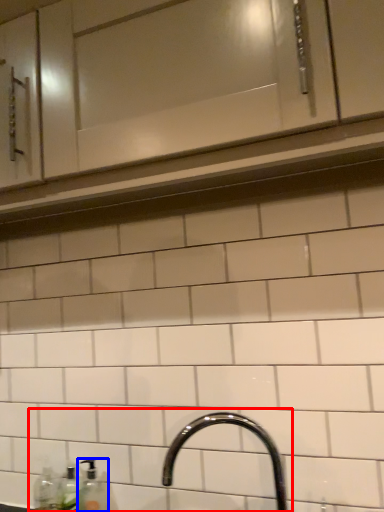
Question: Which object is further to the camera taking this photo, sink (highlighted by a red box) or soap dispenser (highlighted by a blue box)?

Choices:
 (A) sink
 (B) soap dispenser

Answer: (B)